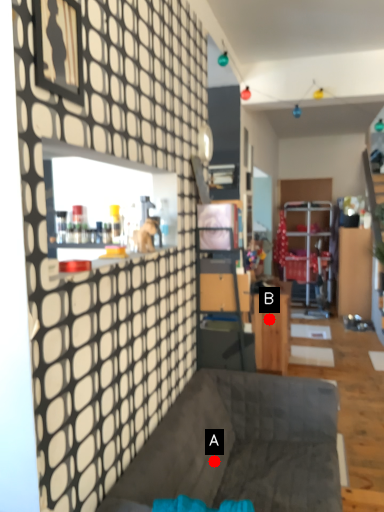
Question: Two points are circled on the image, labeled by A and B beside each circle. Which of the following is the closest to the observer?

Choices:
 (A) A is closer
 (B) B is closer

Answer: (A)